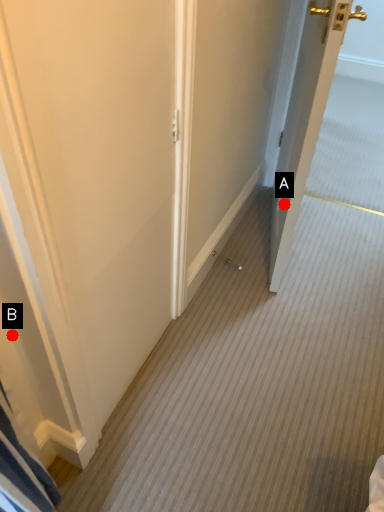
Question: Two points are circled on the image, labeled by A and B beside each circle. Among these points, which one is farthest from the camera?

Choices:
 (A) A is further
 (B) B is further

Answer: (A)